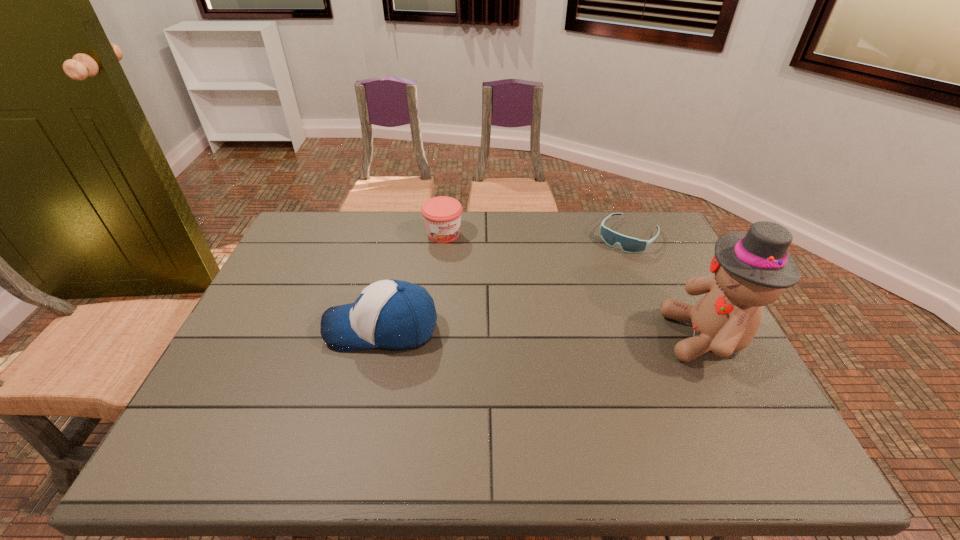
Where is `object at the far right corner`? This screenshot has width=960, height=540. object at the far right corner is located at coordinates (628, 244).

You are a GUI agent. You are given a task and a screenshot of the screen. Output one action in this format:
    pyautogui.click(x=<x>, y=<y>)
    Task: Click on the free space at the far edge of the desktop
    The height and width of the screenshot is (540, 960).
    Given the screenshot: What is the action you would take?
    pyautogui.click(x=497, y=245)

Where is `free point at the near edge`? free point at the near edge is located at coordinates (458, 419).

Locate an element on the screen. vacant space at the left edge is located at coordinates (267, 303).

Where is `blank area at the right edge`? The height and width of the screenshot is (540, 960). blank area at the right edge is located at coordinates (677, 273).

Where is `blank area at the far left corner`? The image size is (960, 540). blank area at the far left corner is located at coordinates (297, 247).

Image resolution: width=960 pixels, height=540 pixels. In order to click on free spot at the near left corner of the desktop in this screenshot , I will do `click(258, 403)`.

Identify the location of blank space at the far right corner. (622, 223).

You are a GUI agent. You are given a task and a screenshot of the screen. Output one action in this format:
    pyautogui.click(x=<x>, y=<y>)
    Task: Click on the free space between the rag_doll and the shortest object
    The height and width of the screenshot is (540, 960).
    Given the screenshot: What is the action you would take?
    pyautogui.click(x=667, y=286)

What are the coordinates of `vacant space in between the shortest object and the third tallest object` in the screenshot? It's located at (536, 235).